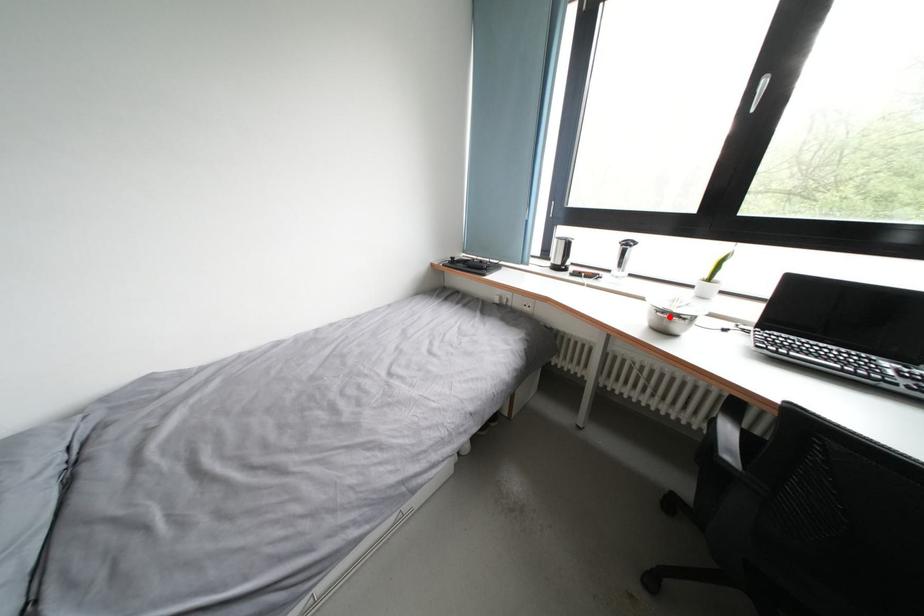
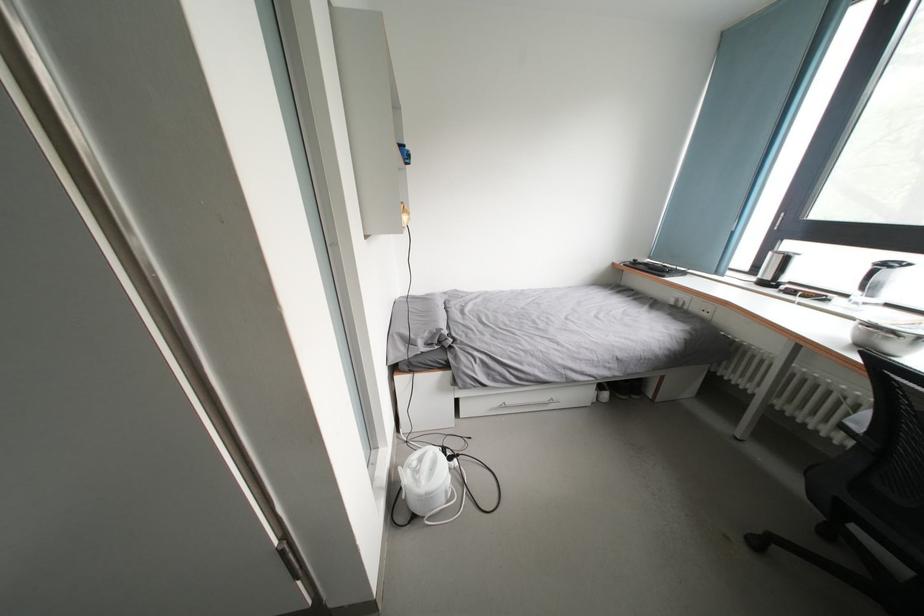
Where in the second image is the point corresponding to the highlighted location from the first image?

(877, 331)